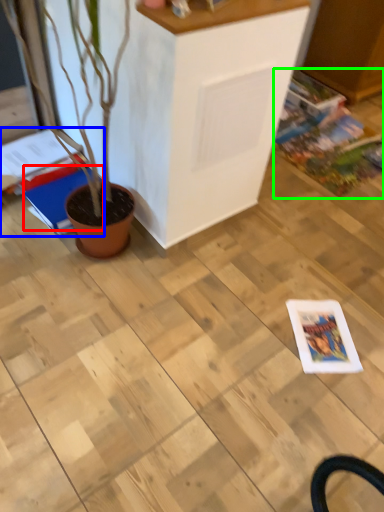
Question: Considering the real-world distances, which object is farthest from magazine (highlighted by a red box)? magazine (highlighted by a blue box) or comic book (highlighted by a green box)?

Choices:
 (A) magazine
 (B) comic book

Answer: (B)